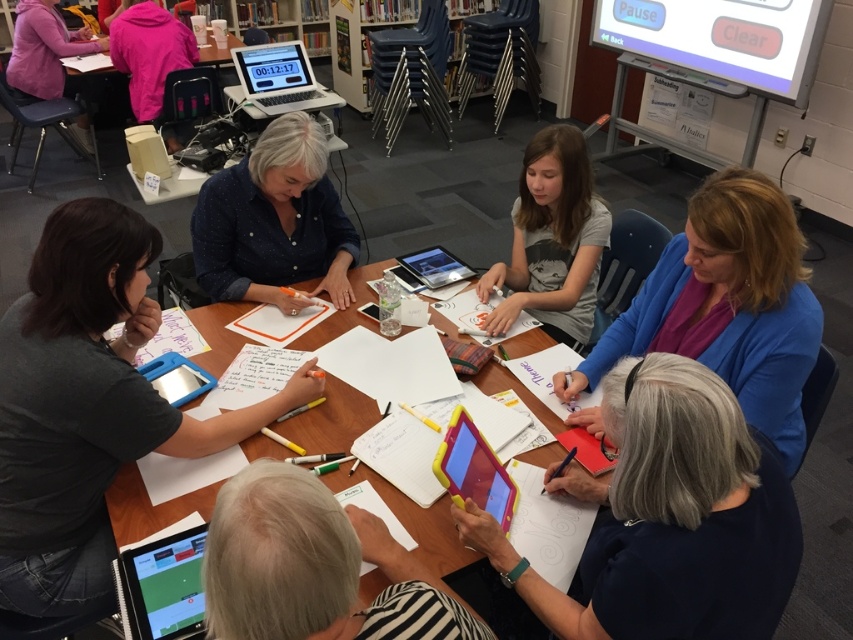
You are a participant in the group and need to pass a note to the person wearing the matte pink hoodie at upper left. The yellow plastic tablet at lower center is blocking your path. Can you pass the note to the left or right side of the tablet?

The yellow plastic tablet at lower center is to the right of the matte pink hoodie at upper left, so you can pass the note to the left side of the yellow plastic tablet at lower center to reach the matte pink hoodie at upper left.

You are standing at the point with coordinates point (314,566). What object are you standing on?

The point (314,566) is on the yellow plastic tablet at lower center.

You are standing at the entrance of the library and see the scene described. There is a person wearing a dark gray shirt at lower left. Can you tell me the exact coordinates where this person is located?

The dark gray shirt at lower left is located at point [88,404].